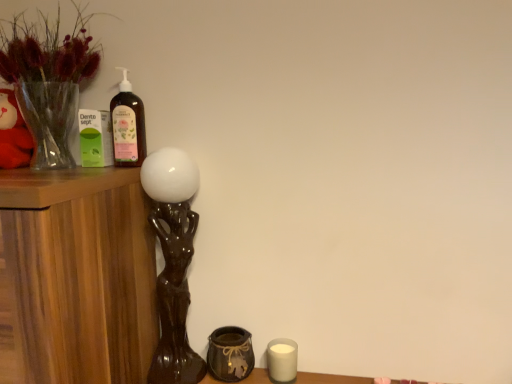
Question: Is translucent glass bottle at upper left turned away from translucent glass vase at upper left?

Choices:
 (A) no
 (B) yes

Answer: (A)

Question: Is translucent glass bottle at upper left aimed at translucent glass vase at upper left?

Choices:
 (A) yes
 (B) no

Answer: (B)

Question: Can you confirm if translucent glass bottle at upper left is wider than translucent glass vase at upper left?

Choices:
 (A) no
 (B) yes

Answer: (A)

Question: Is translucent glass bottle at upper left thinner than translucent glass vase at upper left?

Choices:
 (A) no
 (B) yes

Answer: (B)

Question: From the image's perspective, is translucent glass bottle at upper left on translucent glass vase at upper left?

Choices:
 (A) no
 (B) yes

Answer: (A)

Question: Is point (159, 355) positioned closer to the camera than point (247, 359)?

Choices:
 (A) farther
 (B) closer

Answer: (A)

Question: Is brown glossy table lamp at left taller or shorter than brown textured vase at lower center?

Choices:
 (A) tall
 (B) short

Answer: (A)

Question: Relative to brown textured vase at lower center, is brown glossy table lamp at left in front or behind?

Choices:
 (A) front
 (B) behind

Answer: (A)

Question: From a real-world perspective, is brown glossy table lamp at left above or below brown textured vase at lower center?

Choices:
 (A) below
 (B) above

Answer: (B)

Question: From a real-world perspective, is white matte candle at lower right physically located above or below brown textured vase at lower center?

Choices:
 (A) above
 (B) below

Answer: (B)

Question: In the image, is white matte candle at lower right positioned in front of or behind brown textured vase at lower center?

Choices:
 (A) front
 (B) behind

Answer: (B)

Question: From the image's perspective, is white matte candle at lower right above or below brown textured vase at lower center?

Choices:
 (A) above
 (B) below

Answer: (B)

Question: Looking at the image, does white matte candle at lower right seem bigger or smaller compared to brown textured vase at lower center?

Choices:
 (A) big
 (B) small

Answer: (B)

Question: Based on their sizes in the image, would you say brown glossy table lamp at left is bigger or smaller than translucent glass bottle at upper left?

Choices:
 (A) small
 (B) big

Answer: (B)

Question: Would you say brown glossy table lamp at left is inside or outside translucent glass bottle at upper left?

Choices:
 (A) outside
 (B) inside

Answer: (A)